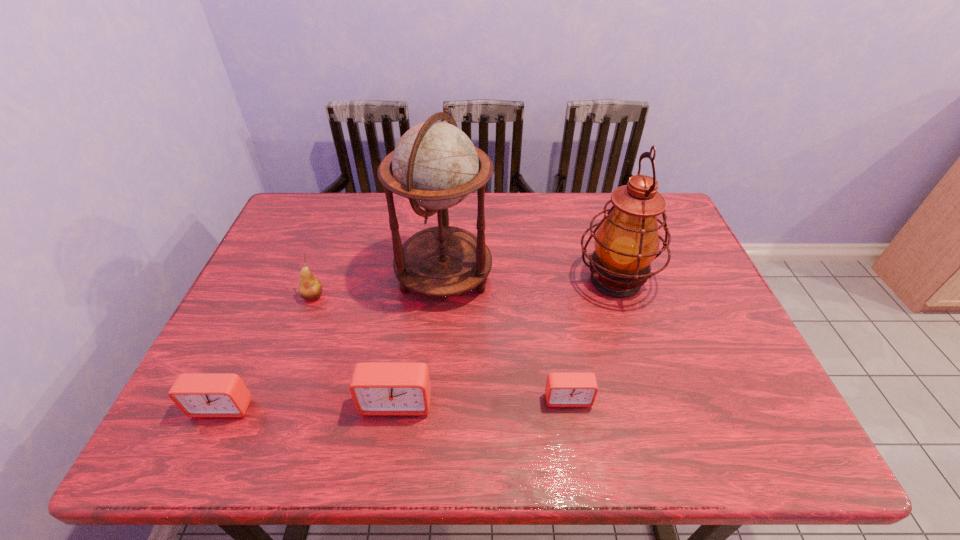
The height and width of the screenshot is (540, 960). Identify the location of vacant area located on the back of the second object from left to right. (329, 252).

Identify the location of alarm clock that is positioned at the left edge. The image size is (960, 540). (201, 395).

Where is `pear at the left edge`? The image size is (960, 540). pear at the left edge is located at coordinates (310, 288).

I want to click on object situated at the right edge, so click(x=627, y=241).

At what (x,y) coordinates should I click in order to perform the action: click on object present at the near left corner. Please return your answer as a coordinate pair (x, y). The image size is (960, 540). Looking at the image, I should click on (201, 395).

Identify the location of vacant position at the far edge of the desktop. The image size is (960, 540). (554, 214).

The width and height of the screenshot is (960, 540). What are the coordinates of `free space at the near edge of the desktop` in the screenshot? It's located at (347, 392).

Identify the location of vacant position at the left edge of the desktop. Image resolution: width=960 pixels, height=540 pixels. (267, 284).

The width and height of the screenshot is (960, 540). In the image, there is a desktop. Find the location of `vacant space at the right edge`. vacant space at the right edge is located at coordinates (732, 371).

In the image, there is a desktop. At what (x,y) coordinates should I click in order to perform the action: click on vacant space at the far left corner. Please return your answer as a coordinate pair (x, y). Looking at the image, I should click on (288, 220).